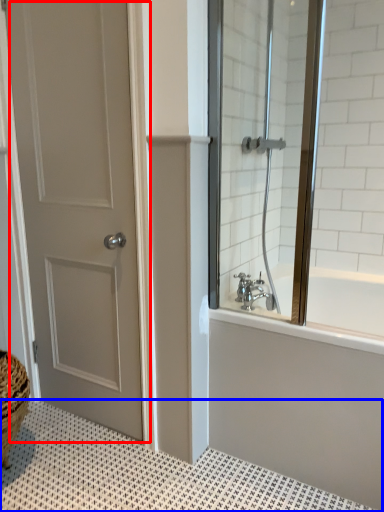
Question: Among these objects, which one is nearest to the camera, door (highlighted by a red box) or bath mat (highlighted by a blue box)?

Choices:
 (A) door
 (B) bath mat

Answer: (B)